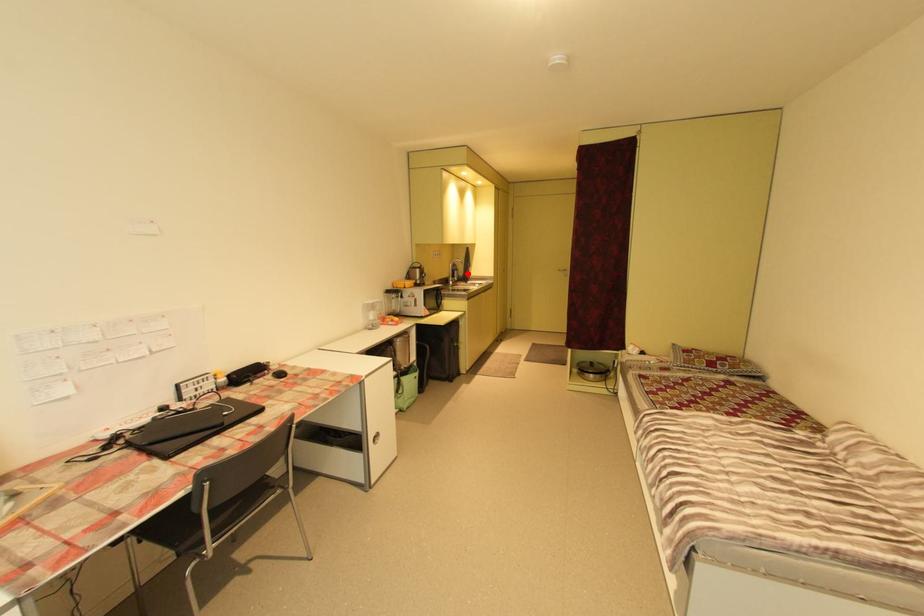
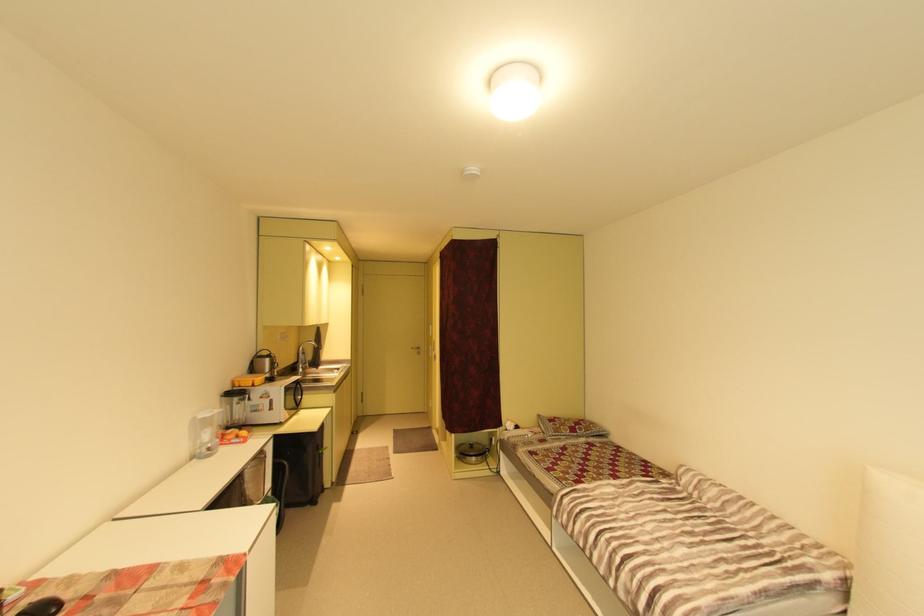
Question: I am providing you with two images of the same scene from different viewpoints. A red point is marked on the first image. Is the red point's position out of view in image 2?

Choices:
 (A) Yes
 (B) No

Answer: (B)